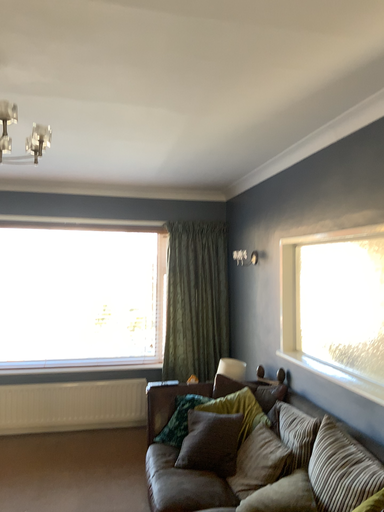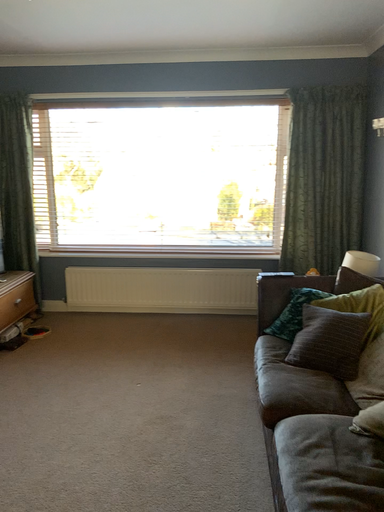
Question: How did the camera likely rotate when shooting the video?

Choices:
 (A) rotated downward
 (B) rotated upward

Answer: (A)